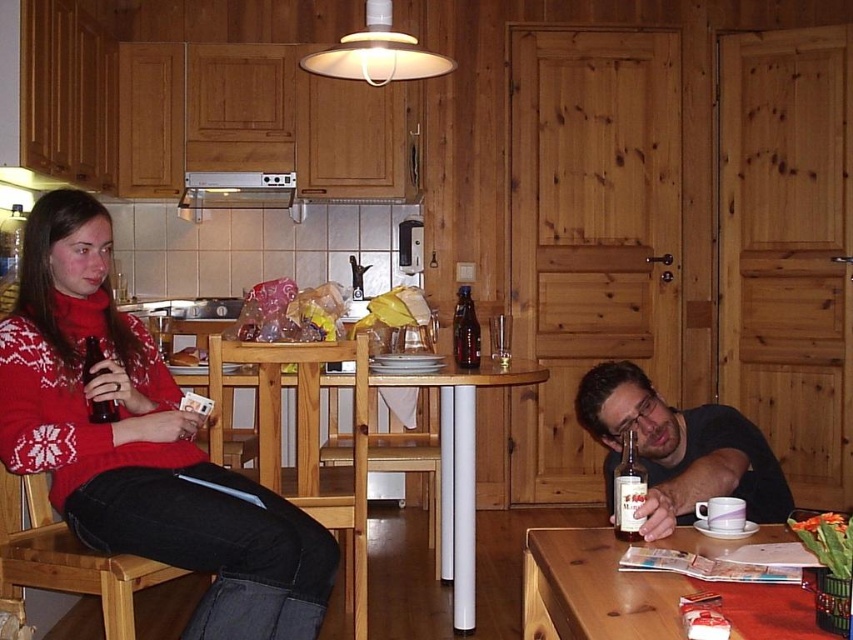
Which of these two, matte red sweater at left or translucent glass bottle at table center, stands shorter?

Standing shorter between the two is translucent glass bottle at table center.

Is point (74, 497) farther from camera compared to point (460, 298)?

No, it is in front of (460, 298).

Locate an element on the screen. This screenshot has height=640, width=853. matte red sweater at left is located at coordinates (141, 444).

Which is more to the left, matte black shirt at lower right or wooden table at lower right?

wooden table at lower right

At what (x,y) coordinates should I click in order to perform the action: click on matte black shirt at lower right. Please return your answer as a coordinate pair (x, y). The height and width of the screenshot is (640, 853). Looking at the image, I should click on (679, 449).

Does matte red sweater at left come behind translucent glass bottle at lower right?

That is True.

Can you confirm if matte red sweater at left is bigger than translucent glass bottle at lower right?

Yes.

Does point (24, 412) come closer to viewer compared to point (624, 528)?

No, it is behind (624, 528).

Locate an element on the screen. The image size is (853, 640). matte red sweater at left is located at coordinates (141, 444).